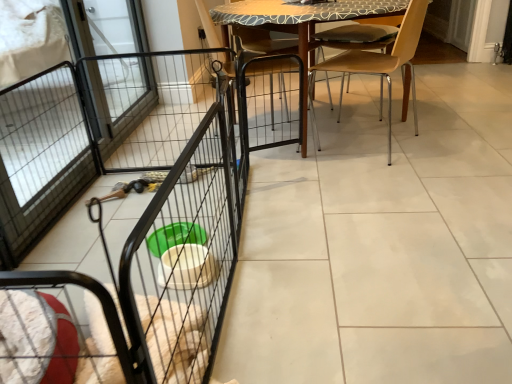
Question: From the image's perspective, relative to wooden chair at center, is black wire screen door at left above or below?

Choices:
 (A) above
 (B) below

Answer: (A)

Question: Which is correct: black wire screen door at left is inside wooden chair at center, or outside of it?

Choices:
 (A) inside
 (B) outside

Answer: (B)

Question: Estimate the real-world distances between objects in this image. Which object is closer to the wooden table at center?

Choices:
 (A) light brown wood chair at center
 (B) black wire screen door at left
 (C) wooden chair at center
 (D) black wire cage at center

Answer: (C)

Question: Estimate the real-world distances between objects in this image. Which object is closer to the black wire screen door at left?

Choices:
 (A) black wire cage at center
 (B) wooden chair at center
 (C) light brown wood chair at center
 (D) wooden table at center

Answer: (D)